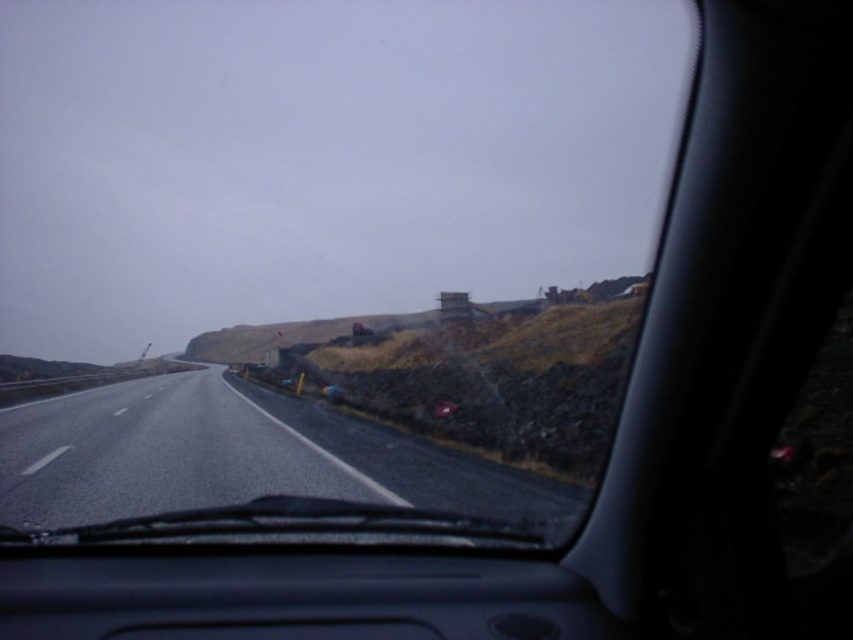
Question: Is transparent glass windshield at center to the left of black asphalt highway at center from the viewer's perspective?

Choices:
 (A) no
 (B) yes

Answer: (B)

Question: Does transparent glass windshield at center lie behind black asphalt highway at center?

Choices:
 (A) yes
 (B) no

Answer: (B)

Question: Considering the relative positions of transparent glass windshield at center and black asphalt highway at center in the image provided, where is transparent glass windshield at center located with respect to black asphalt highway at center?

Choices:
 (A) above
 (B) below

Answer: (A)

Question: Among these objects, which one is nearest to the camera?

Choices:
 (A) transparent glass windshield at center
 (B) black asphalt highway at center

Answer: (A)